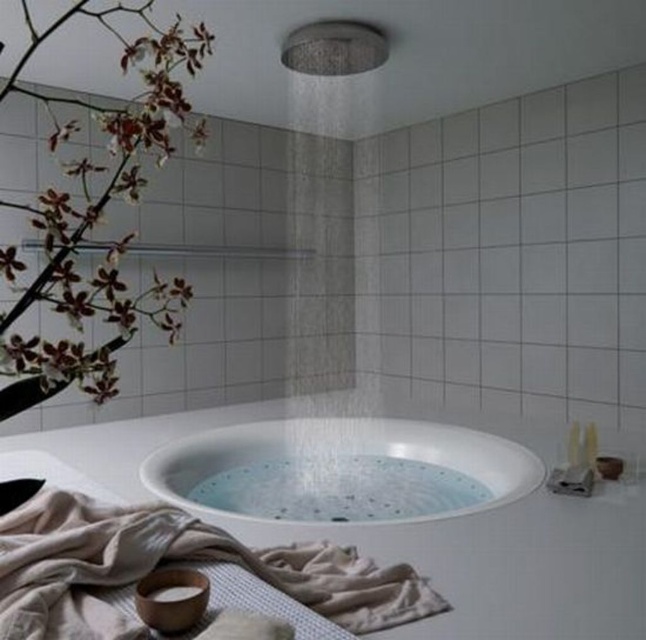
Between point (379, 502) and point (34, 340), which one is positioned in front?

Positioned in front is point (34, 340).

Is white glossy bathtub at center in front of white matte orchid at upper left?

No.

Is point (284, 461) positioned before point (36, 394)?

That is False.

Image resolution: width=646 pixels, height=640 pixels. Find the location of `white glossy bathtub at center`. white glossy bathtub at center is located at coordinates (337, 474).

Between white matte orchid at upper left and matte silver shower head at upper center, which one is positioned higher?

matte silver shower head at upper center is higher up.

Does point (167, 115) lie behind point (353, 33)?

No.

This screenshot has width=646, height=640. In order to click on white matte orchid at upper left in this screenshot , I will do `click(99, 218)`.

Can you confirm if white glossy bathtub at center is positioned below matte silver shower head at upper center?

Yes.

Does white glossy bathtub at center have a greater width compared to matte silver shower head at upper center?

Yes.

Locate an element on the screen. white glossy bathtub at center is located at coordinates (337, 474).

You are a GUI agent. You are given a task and a screenshot of the screen. Output one action in this format:
    pyautogui.click(x=<x>, y=<y>)
    Task: Click on the white glossy bathtub at center
    The width and height of the screenshot is (646, 640).
    Given the screenshot: What is the action you would take?
    pyautogui.click(x=337, y=474)